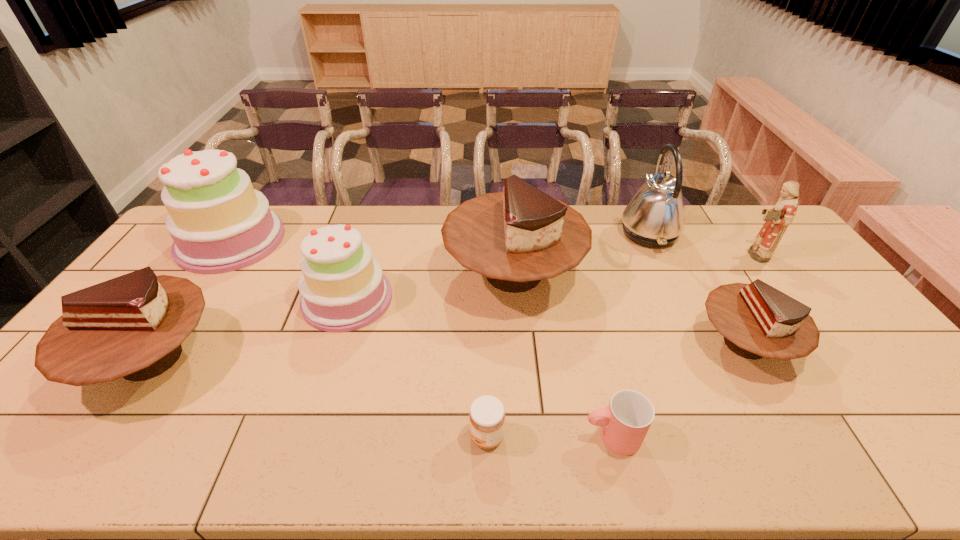
Locate an element on the screen. This screenshot has height=540, width=960. cup that is positioned at the near edge is located at coordinates (625, 422).

Locate an element on the screen. jam that is positioned at the near edge is located at coordinates point(487,416).

The image size is (960, 540). What are the coordinates of `object that is positioned at the right edge` in the screenshot? It's located at (777, 219).

Find the location of `object that is positioned at the far left corner`. object that is positioned at the far left corner is located at coordinates (219, 223).

Find the location of a particular element. Image resolution: width=960 pixels, height=540 pixels. blank space at the far edge is located at coordinates (730, 227).

Find the location of a particular element. This screenshot has height=540, width=960. vacant space at the near left corner is located at coordinates (35, 461).

Locate an element on the screen. This screenshot has height=540, width=960. free location at the far right corner of the desktop is located at coordinates (738, 232).

Locate an element on the screen. free area in between the kettle and the leftmost red cake is located at coordinates (400, 295).

Locate an element on the screen. empty space between the seventh tallest object and the seventh object from right to left is located at coordinates (546, 321).

Locate an element on the screen. The height and width of the screenshot is (540, 960). free space between the figurine and the kettle is located at coordinates (701, 244).